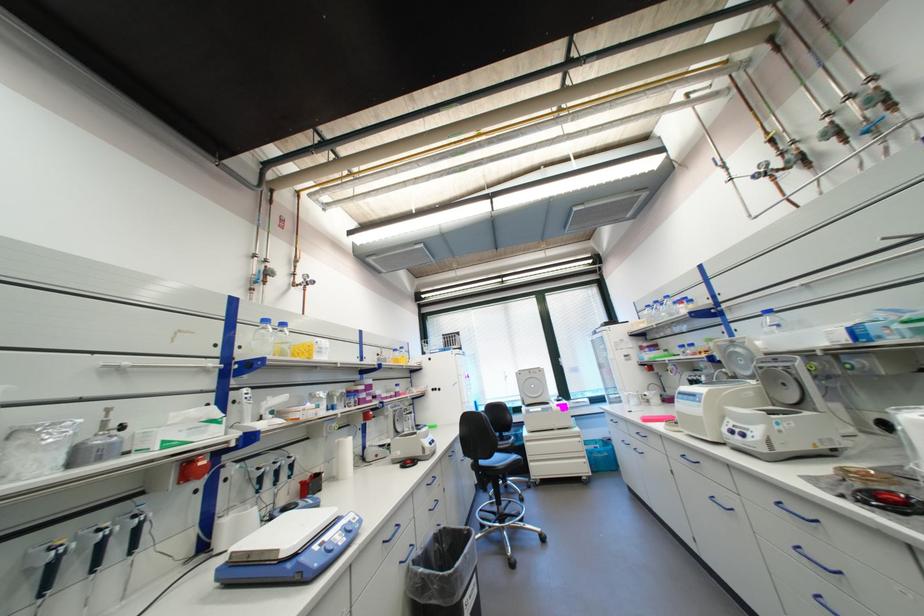
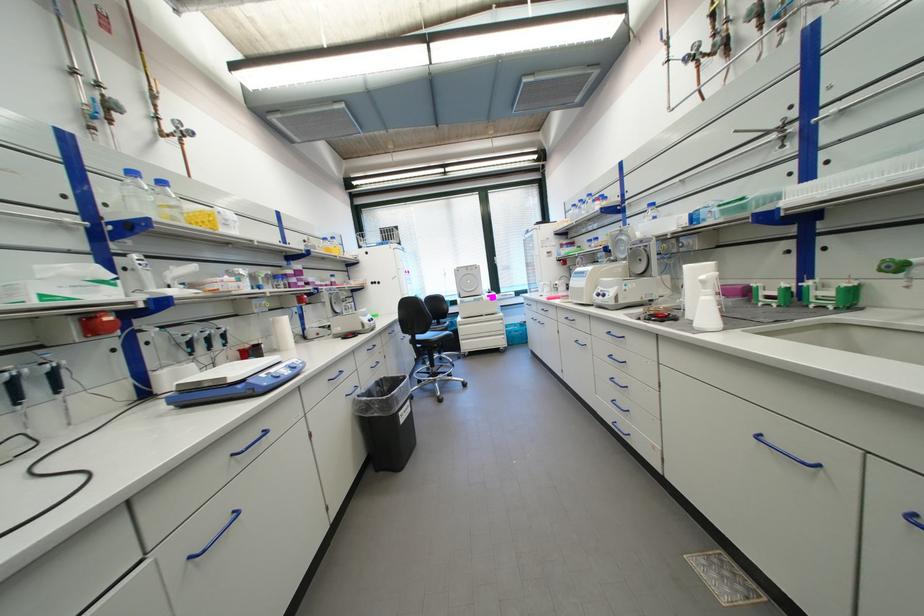
Find the pixel in the second image that matches point 139,554 in the first image.

(65, 394)